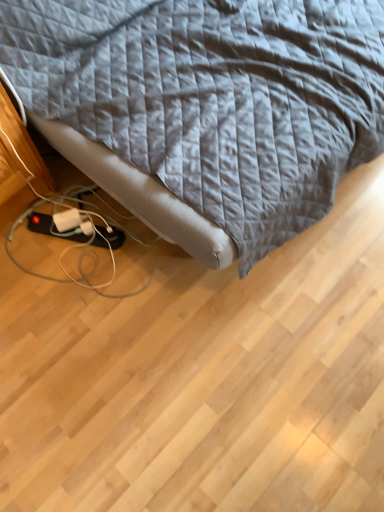
Question: Considering the positions of gray quilted fabric at upper center and white plastic extension cord at lower left in the image, is gray quilted fabric at upper center taller or shorter than white plastic extension cord at lower left?

Choices:
 (A) short
 (B) tall

Answer: (B)

Question: Considering the positions of point (284, 123) and point (66, 221), is point (284, 123) closer or farther from the camera than point (66, 221)?

Choices:
 (A) closer
 (B) farther

Answer: (A)

Question: Looking at the image, does gray quilted fabric at upper center seem bigger or smaller compared to white plastic extension cord at lower left?

Choices:
 (A) small
 (B) big

Answer: (B)

Question: In the image, is white plastic extension cord at lower left positioned in front of or behind gray quilted fabric at upper center?

Choices:
 (A) behind
 (B) front

Answer: (A)

Question: Considering the positions of white plastic extension cord at lower left and gray quilted fabric at upper center in the image, is white plastic extension cord at lower left wider or thinner than gray quilted fabric at upper center?

Choices:
 (A) thin
 (B) wide

Answer: (A)

Question: From the image's perspective, relative to gray quilted fabric at upper center, is white plastic extension cord at lower left above or below?

Choices:
 (A) below
 (B) above

Answer: (A)

Question: Would you say white plastic extension cord at lower left is to the left or to the right of gray quilted fabric at upper center in the picture?

Choices:
 (A) right
 (B) left

Answer: (B)